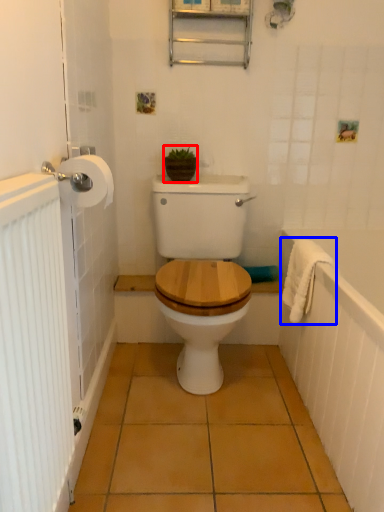
Question: Which point is further to the camera, plant (highlighted by a red box) or bath towel (highlighted by a blue box)?

Choices:
 (A) plant
 (B) bath towel

Answer: (A)